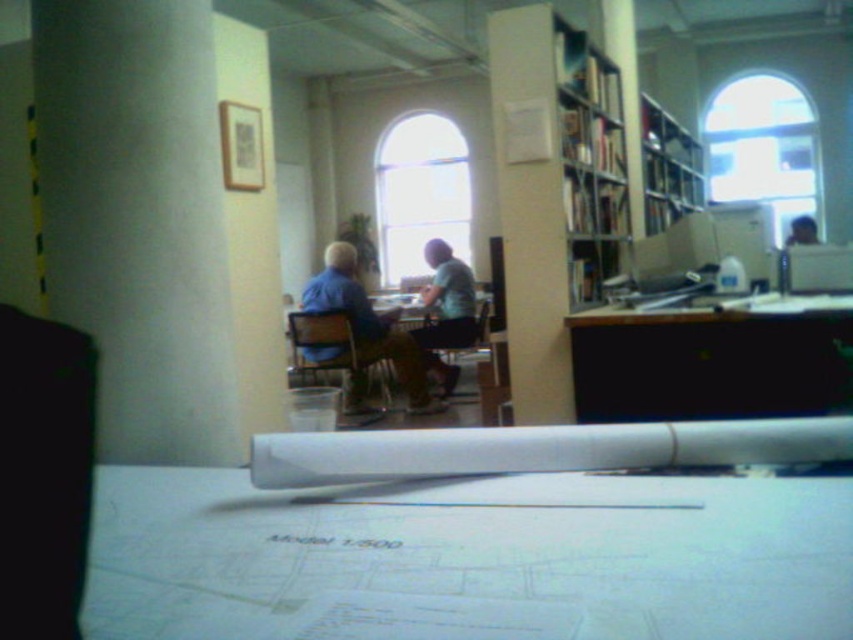
Is wooden bookshelf at upper right bigger than smooth plastic cup at upper right?

Indeed, wooden bookshelf at upper right has a larger size compared to smooth plastic cup at upper right.

Is point (691, 182) farther from viewer compared to point (801, 224)?

That is False.

Where is `wooden bookshelf at upper right`? wooden bookshelf at upper right is located at coordinates (666, 168).

The width and height of the screenshot is (853, 640). What are the coordinates of `wooden bookshelf at upper right` in the screenshot? It's located at (666, 168).

Can you confirm if wooden bookshelf at center is positioned above blue fabric shirt at center?

Correct, wooden bookshelf at center is located above blue fabric shirt at center.

Based on the photo, does wooden bookshelf at center have a lesser height compared to blue fabric shirt at center?

In fact, wooden bookshelf at center may be taller than blue fabric shirt at center.

Identify the location of wooden bookshelf at center. Image resolution: width=853 pixels, height=640 pixels. (553, 193).

Identify the location of wooden bookshelf at center. The height and width of the screenshot is (640, 853). (553, 193).

Between white paper at center and light blue fabric shirt at center, which one is positioned lower?

white paper at center

How much distance is there between white paper at center and light blue fabric shirt at center?

The distance of white paper at center from light blue fabric shirt at center is 16.90 feet.

Locate an element on the screen. white paper at center is located at coordinates (469, 557).

Find the location of `white paper at center`. white paper at center is located at coordinates pos(469,557).